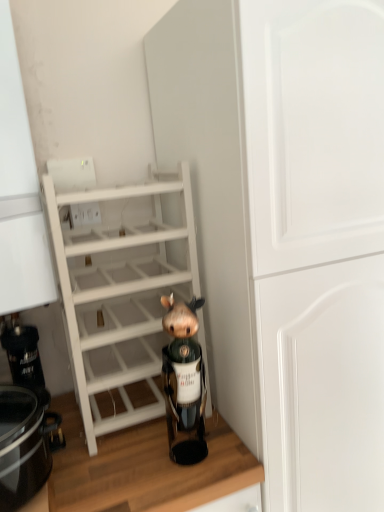
The width and height of the screenshot is (384, 512). I want to click on vacant space to the left of brown matte figurine at center, so click(x=128, y=462).